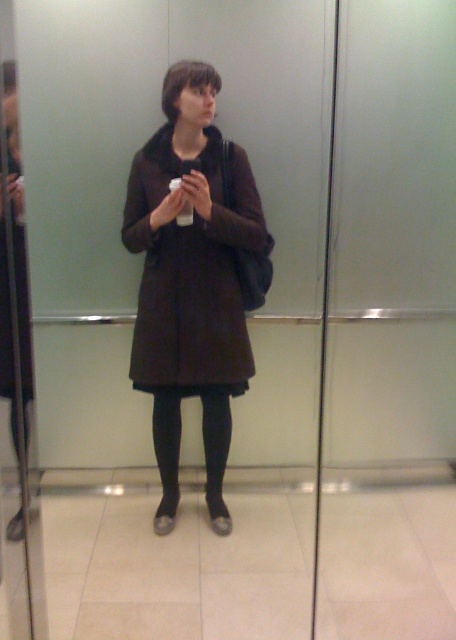
Question: Considering the relative positions of matte brown coat at center and black tights at lower center in the image provided, where is matte brown coat at center located with respect to black tights at lower center?

Choices:
 (A) below
 (B) above

Answer: (B)

Question: Which point is farther to the camera?

Choices:
 (A) black tights at lower center
 (B) matte brown coat at center

Answer: (A)

Question: Considering the relative positions of matte brown coat at center and black tights at lower center in the image provided, where is matte brown coat at center located with respect to black tights at lower center?

Choices:
 (A) below
 (B) above

Answer: (B)

Question: Does matte brown coat at center have a greater width compared to black tights at lower center?

Choices:
 (A) yes
 (B) no

Answer: (A)